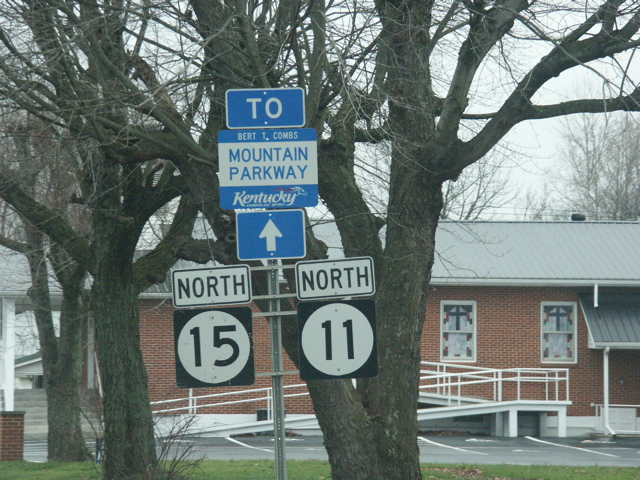
This screenshot has width=640, height=480. I want to click on hand rails, so click(241, 400).